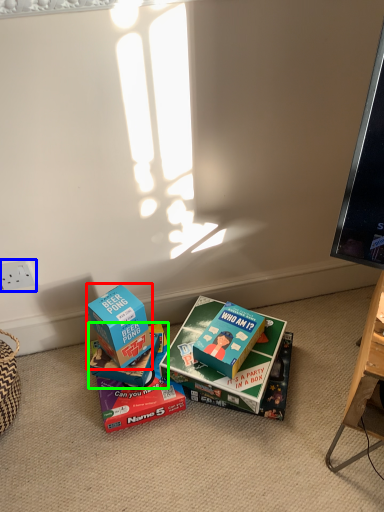
Question: Which is nearer to the box (highlighted by a red box)? power outlet (highlighted by a blue box) or box (highlighted by a green box).

Choices:
 (A) power outlet
 (B) box

Answer: (B)